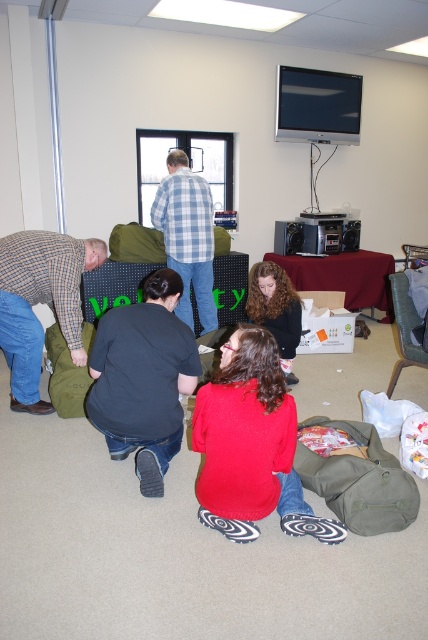
You are a photographer standing in the room and want to capture a closeup of the black cotton shirt at lower center and curly hair at lower center. Which object would you need to frame more widely in your shot?

The black cotton shirt at lower center has a larger width than the curly hair at lower center, so you would need to frame the black cotton shirt at lower center more widely in your shot.

You are standing at the entrance of the room and see the black cotton shirt at lower center. If you walk straight towards it, will you reach the shirt before reaching the back wall?

The position of black cotton shirt at lower center is at point (x=143, y=378), so you will reach the shirt before the back wall.